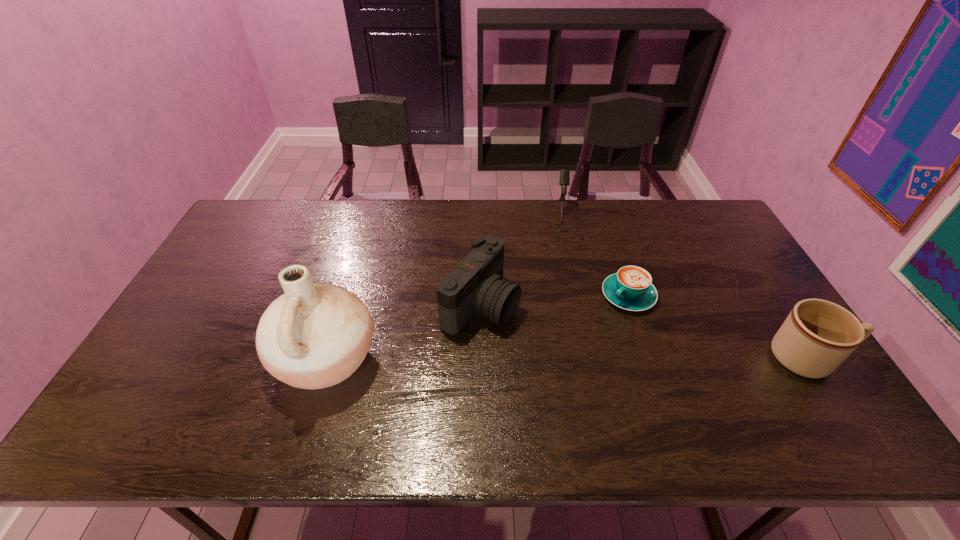
Image resolution: width=960 pixels, height=540 pixels. Identify the location of vacant space located 0.260m with the handle on the right side of the cappuccino. (553, 359).

Locate an element on the screen. The height and width of the screenshot is (540, 960). vacant space located 0.120m with the handle on the right side of the cappuccino is located at coordinates (587, 331).

This screenshot has height=540, width=960. In order to click on vacant space located 0.170m with the handle on the right side of the cappuccino in this screenshot , I will do `click(575, 341)`.

You are a GUI agent. You are given a task and a screenshot of the screen. Output one action in this format:
    pyautogui.click(x=<x>, y=<y>)
    Task: Click on the vacant region located 0.380m at the lens of the second object from left to right
    The width and height of the screenshot is (960, 540).
    Given the screenshot: What is the action you would take?
    pyautogui.click(x=649, y=386)

Where is `vacant space located at the lens of the second object from left to right`? This screenshot has width=960, height=540. vacant space located at the lens of the second object from left to right is located at coordinates (653, 388).

You are a GUI agent. You are given a task and a screenshot of the screen. Output one action in this format:
    pyautogui.click(x=<x>, y=<y>)
    Task: Click on the vacant space situated at the lens of the second object from left to right
    Image resolution: width=960 pixels, height=540 pixels.
    Given the screenshot: What is the action you would take?
    pyautogui.click(x=567, y=347)

Locate an element on the screen. free region located on the stand of the microphone is located at coordinates (568, 330).

Where is `vacant space located 0.340m on the stand of the microphone`? Image resolution: width=960 pixels, height=540 pixels. vacant space located 0.340m on the stand of the microphone is located at coordinates (567, 320).

You are a GUI agent. You are given a task and a screenshot of the screen. Output one action in this format:
    pyautogui.click(x=<x>, y=<y>)
    Task: Click on the blank area located on the stand of the microphone
    Image resolution: width=960 pixels, height=540 pixels.
    Given the screenshot: What is the action you would take?
    pyautogui.click(x=563, y=256)

Locate an element on the screen. This screenshot has width=960, height=540. object that is at the far edge is located at coordinates (564, 180).